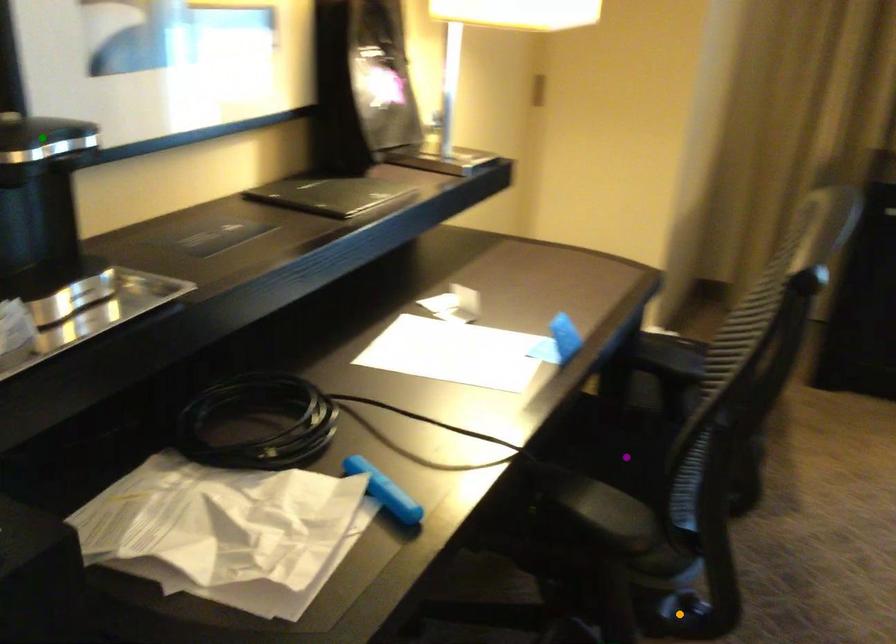
Looking at this image, order these from nearest to farthest:
- purple point
- green point
- orange point

green point, orange point, purple point